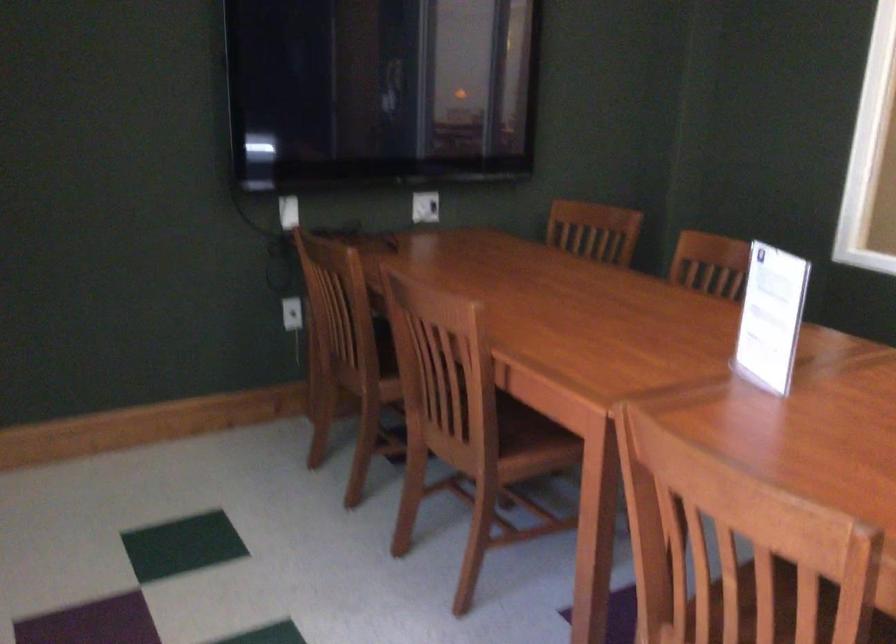
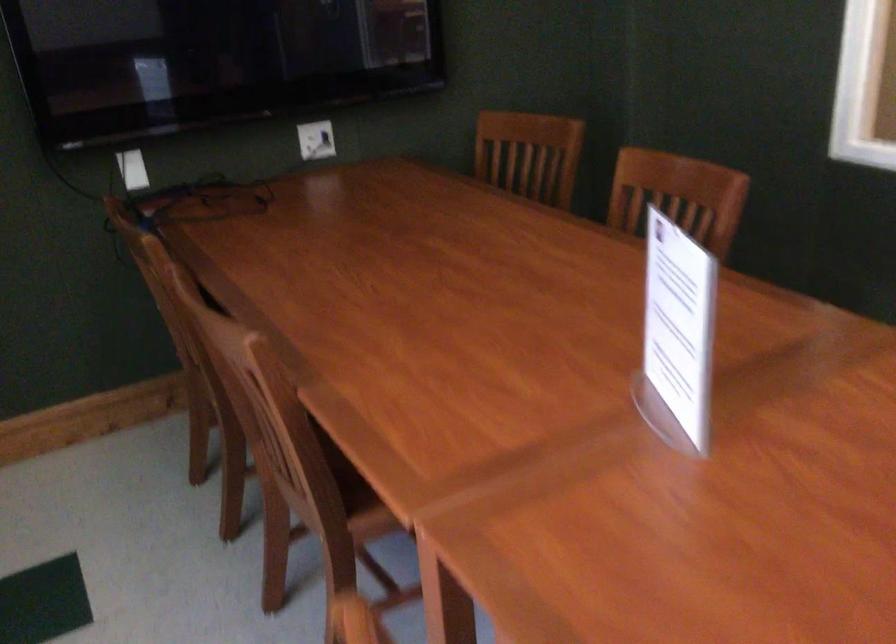
The point at [490,368] is marked in the first image. Where is the corresponding point in the second image?

(299, 413)